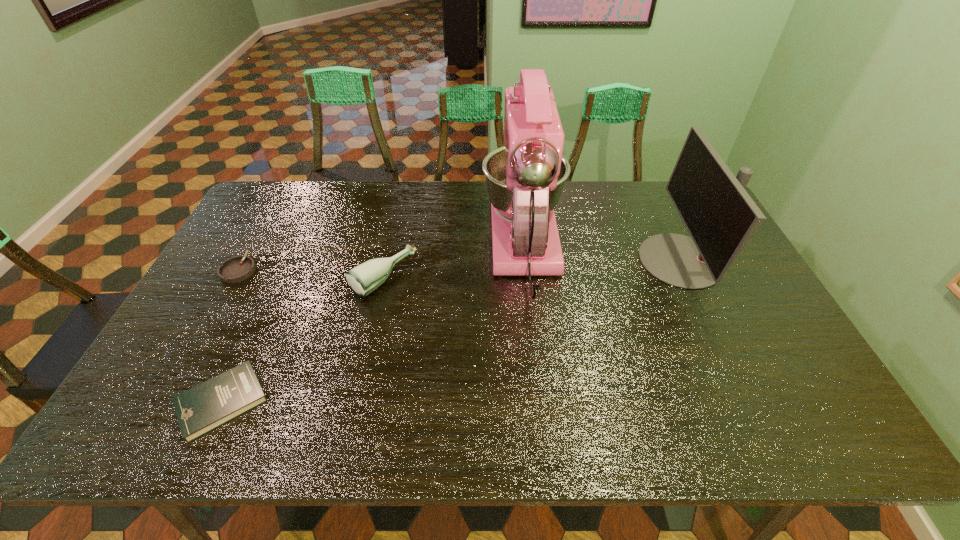
At what (x,y) coordinates should I click in order to perform the action: click on book present at the left edge. Please return your answer as a coordinate pair (x, y). Looking at the image, I should click on [x=199, y=410].

Where is `object at the right edge`? The width and height of the screenshot is (960, 540). object at the right edge is located at coordinates (720, 216).

Where is `object situated at the near left corner`? Image resolution: width=960 pixels, height=540 pixels. object situated at the near left corner is located at coordinates (199, 410).

You are a GUI agent. You are given a task and a screenshot of the screen. Output one action in this format:
    pyautogui.click(x=<x>, y=<y>)
    Task: Click on the object at the far right corner
    Image resolution: width=960 pixels, height=540 pixels.
    Given the screenshot: What is the action you would take?
    pyautogui.click(x=720, y=216)

In the image, there is a desktop. At what (x,y) coordinates should I click in order to perform the action: click on free space at the far edge. Please return your answer as a coordinate pair (x, y). Looking at the image, I should click on (589, 202).

You are a GUI agent. You are given a task and a screenshot of the screen. Output one action in this format:
    pyautogui.click(x=<x>, y=<y>)
    Task: Click on the blank space at the near edge
    This screenshot has width=960, height=540.
    Given the screenshot: What is the action you would take?
    pyautogui.click(x=539, y=411)

The image size is (960, 540). In order to click on vacant area at the left edge in this screenshot , I will do `click(210, 310)`.

The width and height of the screenshot is (960, 540). Find the location of `vacant area at the right edge`. vacant area at the right edge is located at coordinates (759, 336).

In the image, there is a desktop. Where is `vacant space at the far left corner`? The width and height of the screenshot is (960, 540). vacant space at the far left corner is located at coordinates (261, 204).

At what (x,y) coordinates should I click in order to perform the action: click on vacant space that's between the ashtray and the book. Please return your answer as a coordinate pair (x, y). This screenshot has width=960, height=540. Looking at the image, I should click on (230, 335).